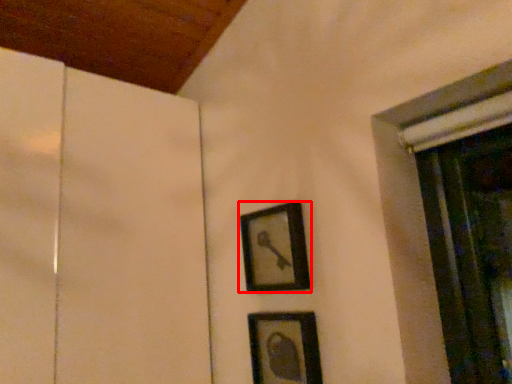
Question: Where is picture frame (annotated by the red box) located in relation to picture frame in the image?

Choices:
 (A) left
 (B) right

Answer: (A)